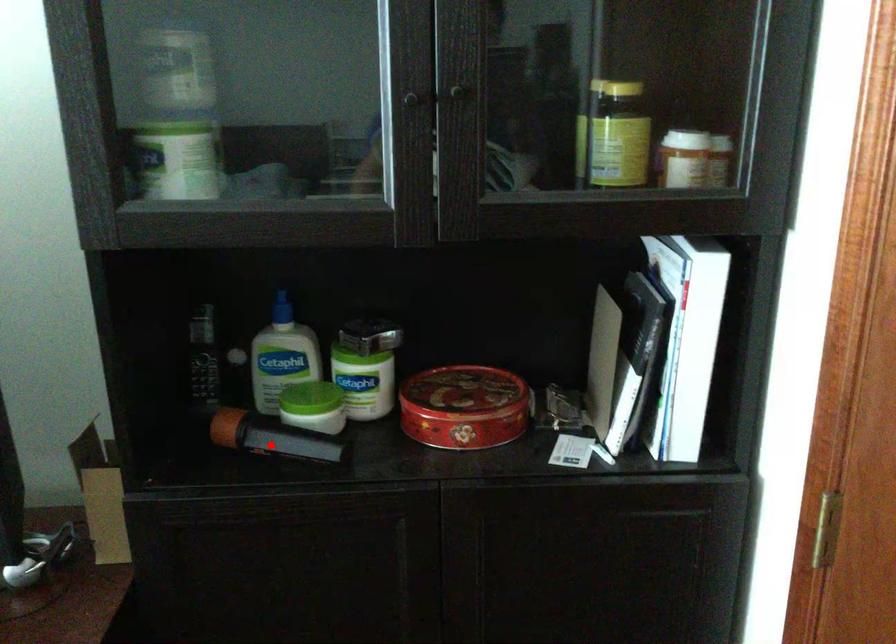
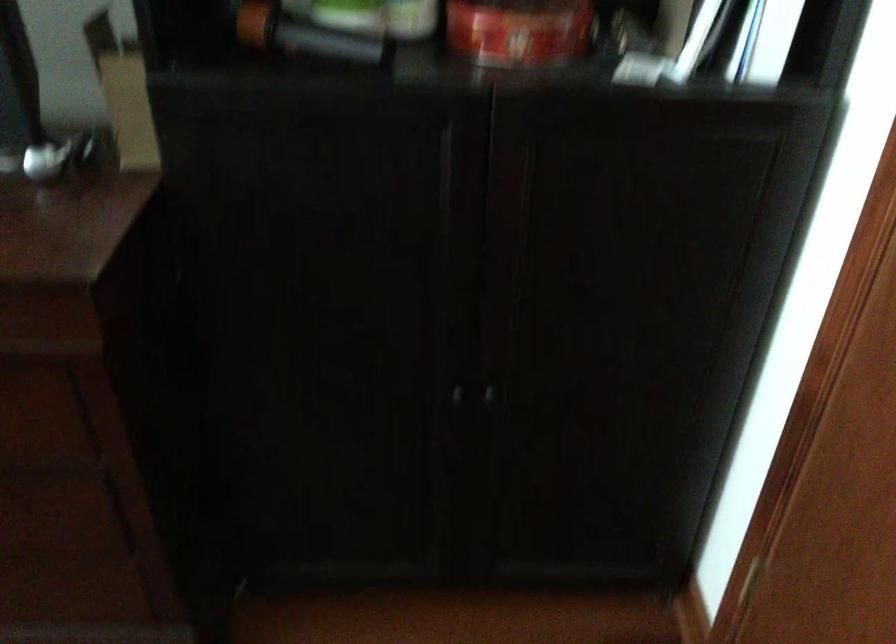
Question: I am providing you with two images of the same scene from different viewpoints. In image1, a red point is highlighted. Considering the same 3D point in image2, which of the following is correct?

Choices:
 (A) It is closer
 (B) It is farther

Answer: (A)